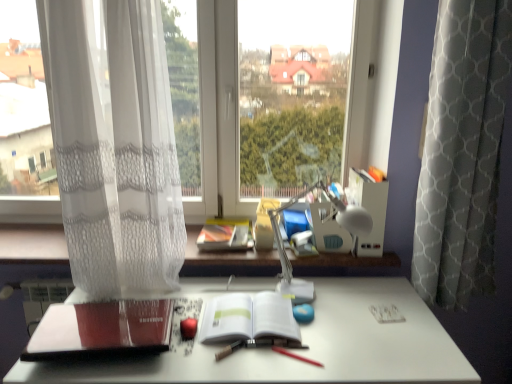
You are a GUI agent. You are given a task and a screenshot of the screen. Output one action in this format:
    pyautogui.click(x=<x>, y=<y>)
    Task: Click on the free space between white paper at center, marked as the 2th paperback book in a left-to-right arrangement, and smooth red crayon at center
    The height and width of the screenshot is (384, 512).
    Given the screenshot: What is the action you would take?
    pyautogui.click(x=286, y=352)